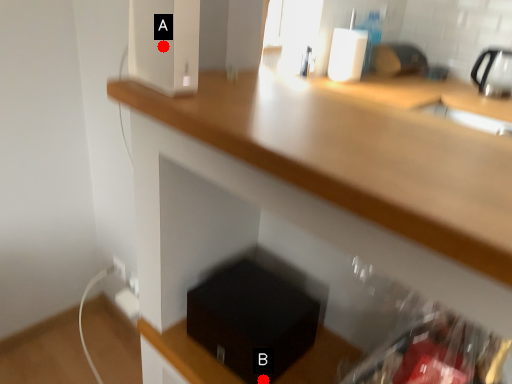
Question: Two points are circled on the image, labeled by A and B beside each circle. Which point is closer to the camera taking this photo?

Choices:
 (A) A is closer
 (B) B is closer

Answer: (A)